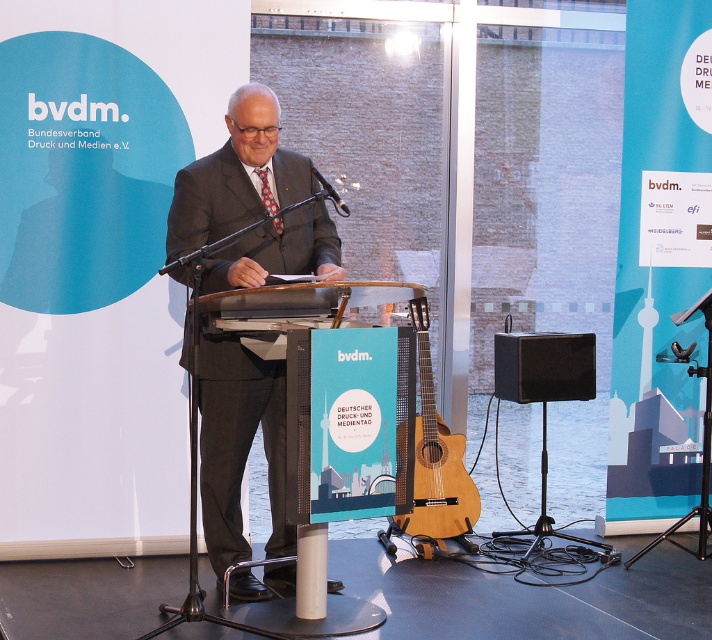
You are attending the event and want to take a photo of the man at the podium. You notice two points marked on your map as reference points for positioning. The first point is at coordinates point (456,504) and the second is at point (267,211). To ensure the man and the banners are fully visible in your photo, which point should you stand closer to?

You should stand closer to point (267,211) because point (456,504) is behind it, so standing closer to the front point will ensure both the man and the banners are visible.

You are standing in the audience at the event and want to take a photo of the podium. The camera you have can only focus on objects within 4 meters. Is the point at coordinates point [236,122] on the podium within the camera focus range?

The distance of point [236,122] from viewer is 4.25 meters, so the camera cannot focus on it since it is beyond the 4 meters range.